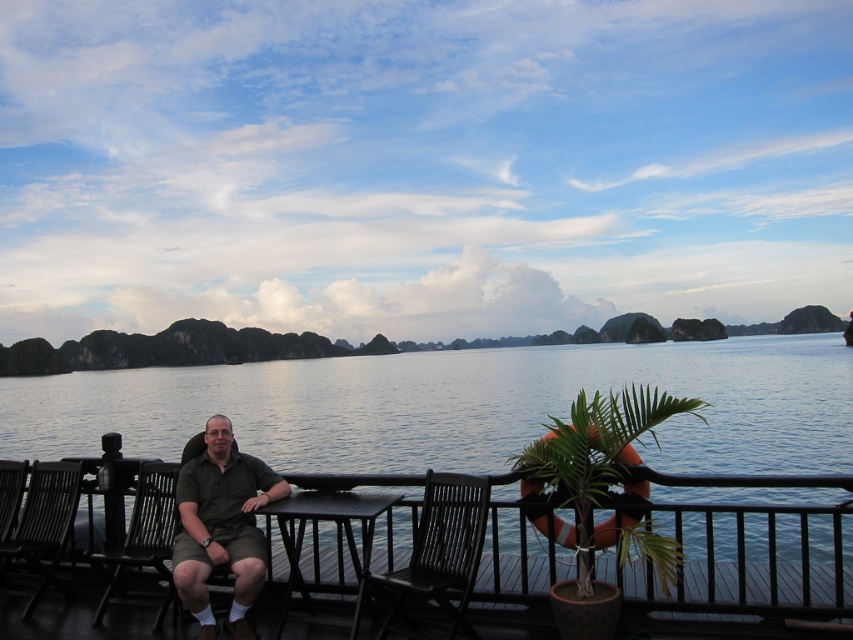
What do you see at coordinates (444, 547) in the screenshot? This screenshot has height=640, width=853. I see `black wood chair at center` at bounding box center [444, 547].

Does black wood chair at center appear on the right side of black plastic chair at lower left?

Indeed, black wood chair at center is positioned on the right side of black plastic chair at lower left.

Who is more forward, (456,577) or (96,616)?

Point (456,577) is in front.

Locate an element on the screen. Image resolution: width=853 pixels, height=640 pixels. black wood chair at center is located at coordinates (444, 547).

Is black wood chair at center further to the viewer compared to black wood chair at left?

No, it is in front of black wood chair at left.

Which of these two, black wood chair at center or black wood chair at left, stands taller?

black wood chair at center

Which is behind, point (410, 589) or point (15, 532)?

Positioned behind is point (15, 532).

Locate an element on the screen. The height and width of the screenshot is (640, 853). black wood chair at center is located at coordinates (444, 547).

Who is more distant from viewer, [318,588] or [229,625]?

The point [318,588] is more distant.

Does black wood rail at center come behind green matte shirt at center?

No, black wood rail at center is closer to the viewer.

The image size is (853, 640). What do you see at coordinates (403, 556) in the screenshot?
I see `black wood rail at center` at bounding box center [403, 556].

This screenshot has height=640, width=853. Identify the location of black wood rail at center. (403, 556).